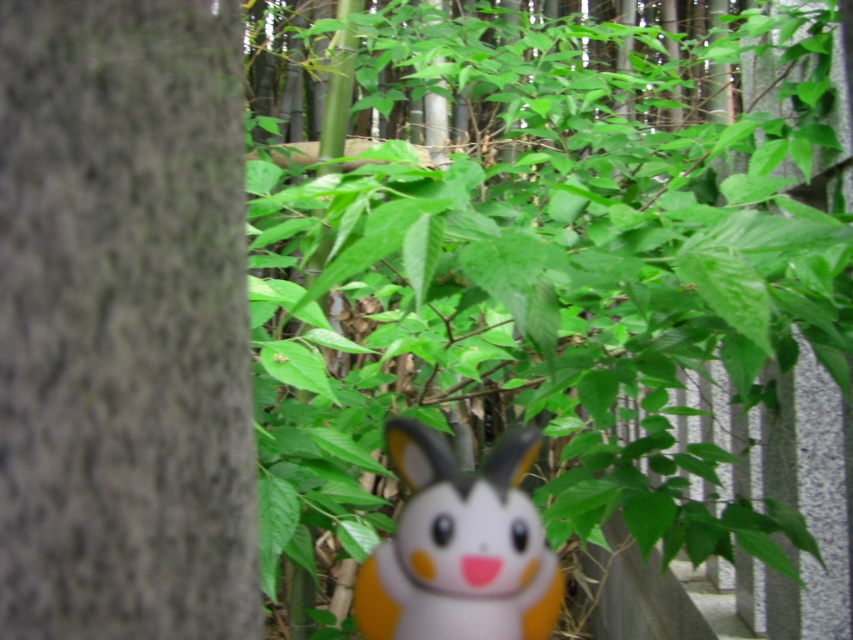
Question: Among these objects, which one is farthest from the camera?

Choices:
 (A) green leafy plant at center
 (B) gray rough bark at center

Answer: (A)

Question: Which object is the farthest from the gray rough bark at center?

Choices:
 (A) orange matte plush toy at center
 (B) green leafy plant at center

Answer: (B)

Question: Does gray rough bark at center appear over orange matte plush toy at center?

Choices:
 (A) no
 (B) yes

Answer: (B)

Question: Observing the image, what is the correct spatial positioning of green leafy plant at center in reference to orange matte plush toy at center?

Choices:
 (A) above
 (B) below

Answer: (A)

Question: Among these objects, which one is nearest to the camera?

Choices:
 (A) orange matte plush toy at center
 (B) green leafy plant at center

Answer: (B)

Question: Can you confirm if green leafy plant at center is positioned to the left of orange matte plush toy at center?

Choices:
 (A) no
 (B) yes

Answer: (A)